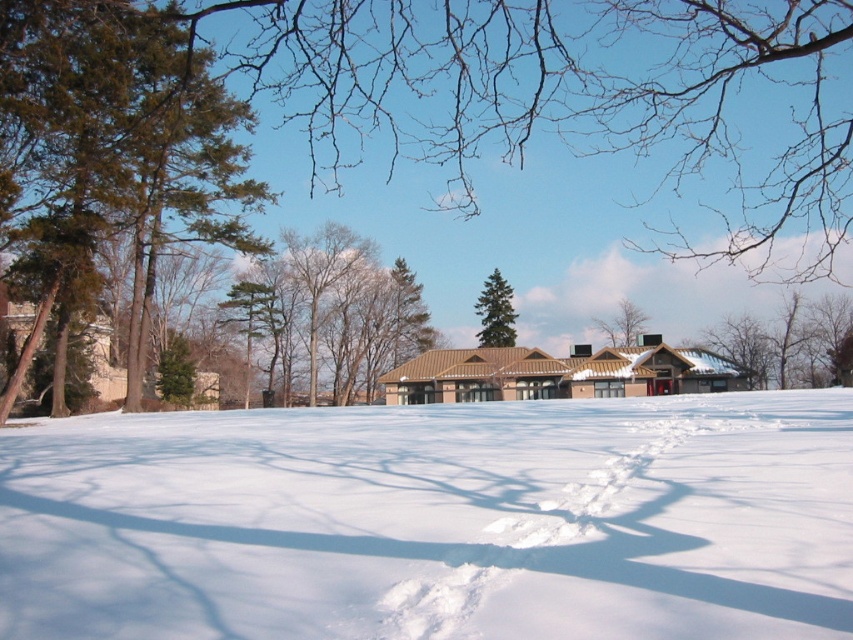
Question: Which of these objects is positioned closest to the white fluffy snow at center?

Choices:
 (A) green matte tree at center
 (B) green leafy tree at upper center

Answer: (A)

Question: Observing the image, what is the correct spatial positioning of green evergreen tree at left in reference to green matte tree at center?

Choices:
 (A) right
 (B) left

Answer: (B)

Question: Does white fluffy snow at center have a larger size compared to green leafy tree at upper center?

Choices:
 (A) yes
 (B) no

Answer: (A)

Question: Among these points, which one is nearest to the camera?

Choices:
 (A) (641, 330)
 (B) (242, 291)

Answer: (A)

Question: Where is white fluffy snow at center located in relation to brown textured tree at center in the image?

Choices:
 (A) right
 (B) left

Answer: (A)

Question: Which point is farther to the camera?

Choices:
 (A) (228, 182)
 (B) (645, 317)

Answer: (B)